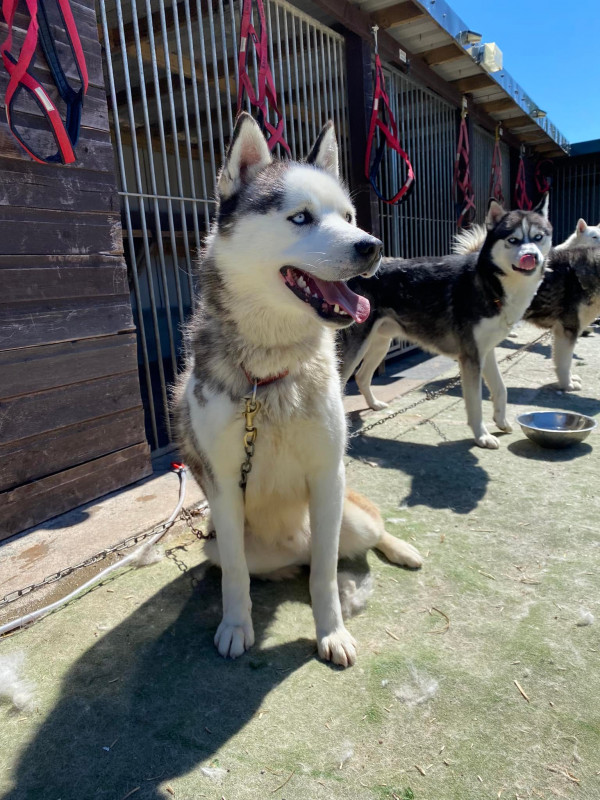
At what (x,y) coordinates should I click in order to perform the action: click on bowl. Please return your answer as a coordinate pair (x, y). This screenshot has width=600, height=800. Looking at the image, I should click on click(570, 434).